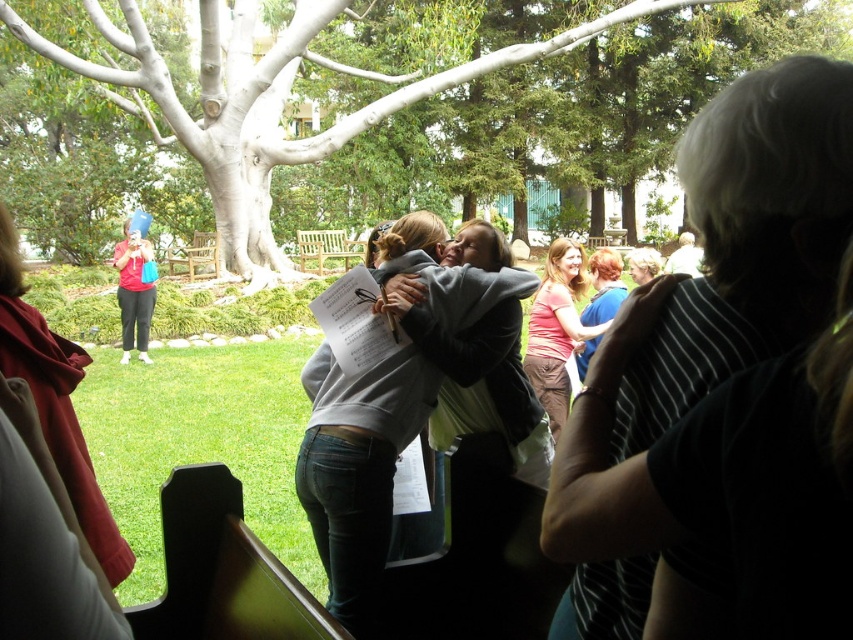
Is white textured tree at center shorter than pink fabric shirt at center?

No, white textured tree at center is not shorter than pink fabric shirt at center.

Between white textured tree at center and pink fabric shirt at center, which one appears on the left side from the viewer's perspective?

From the viewer's perspective, pink fabric shirt at center appears more on the left side.

What do you see at coordinates (445, 83) in the screenshot? I see `white textured tree at center` at bounding box center [445, 83].

Locate an element on the screen. Image resolution: width=853 pixels, height=640 pixels. white textured tree at center is located at coordinates (445, 83).

Based on the photo, is pink fabric shirt at center below matte red shirt at left?

Yes.

Which is more to the left, pink fabric shirt at center or matte red shirt at left?

From the viewer's perspective, matte red shirt at left appears more on the left side.

Looking at this image, who is more distant from viewer, (538, 340) or (125, 273)?

Point (125, 273)

I want to click on pink fabric shirt at center, so click(x=556, y=328).

Is gray sweatshirt at center positioned in front of pink fabric shirt at center?

Yes.

Is gray sweatshirt at center wider than pink fabric shirt at center?

Indeed, gray sweatshirt at center has a greater width compared to pink fabric shirt at center.

Who is more forward, (x=445, y=268) or (x=548, y=250)?

Point (x=445, y=268)

Image resolution: width=853 pixels, height=640 pixels. I want to click on gray sweatshirt at center, so click(358, 468).